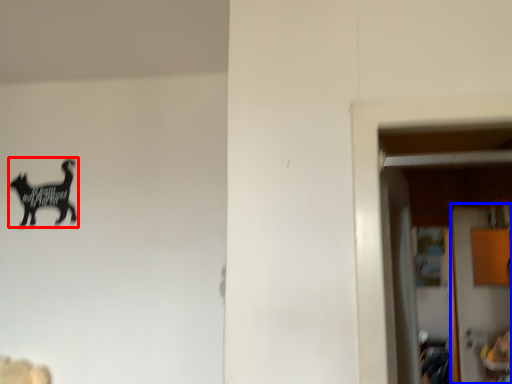
Question: Which point is further to the camera, animal (highlighted by a red box) or door (highlighted by a blue box)?

Choices:
 (A) animal
 (B) door

Answer: (B)